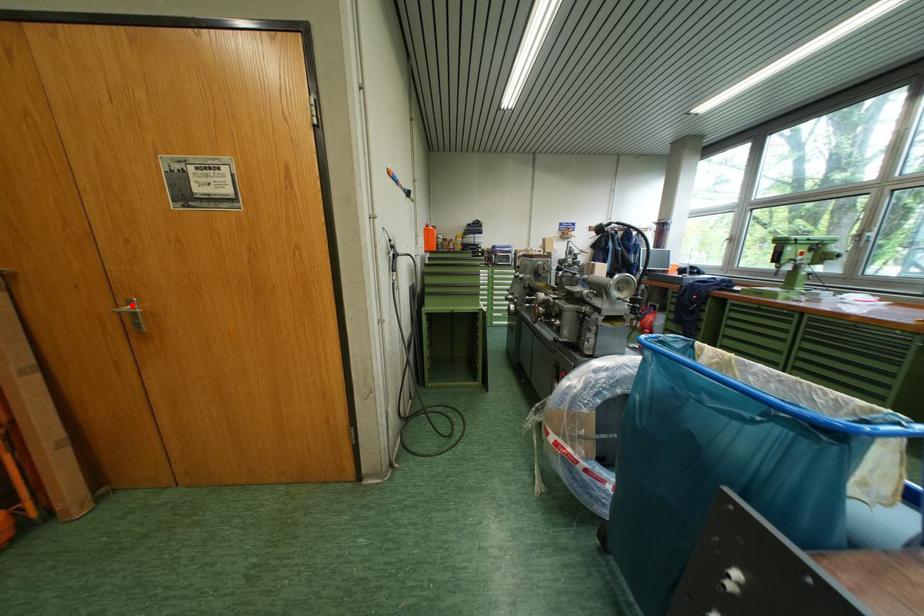
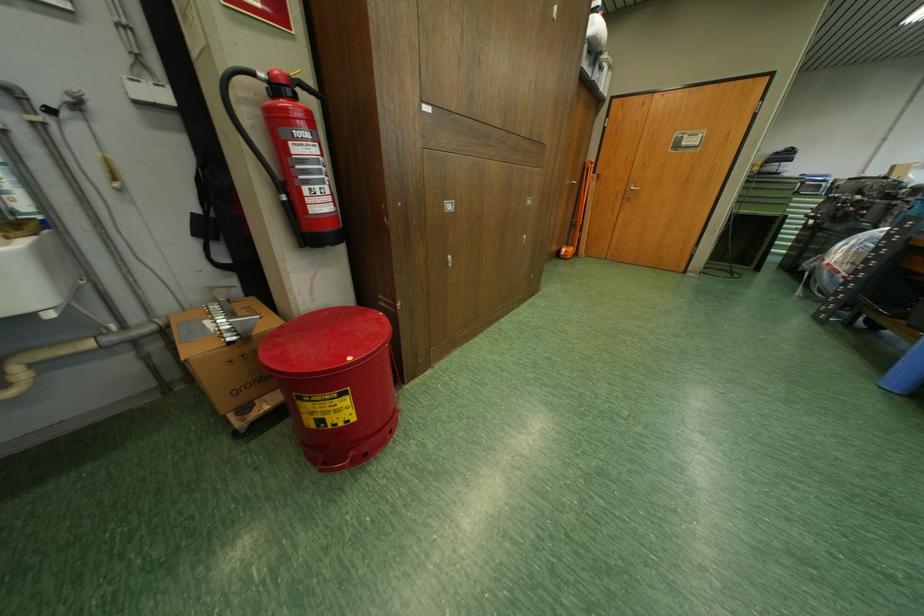
In the second image, find the point that corresponds to the highlighted location in the first image.

(638, 188)